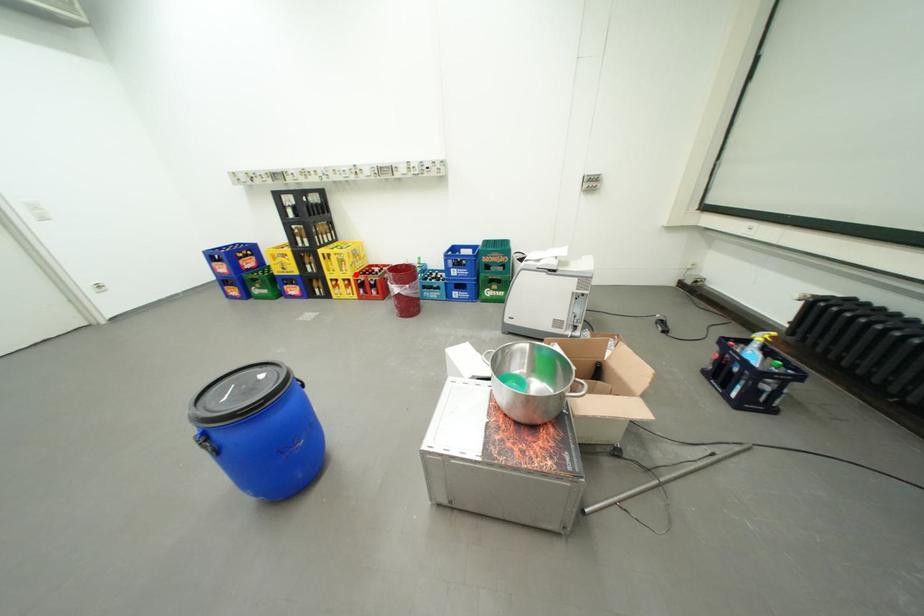
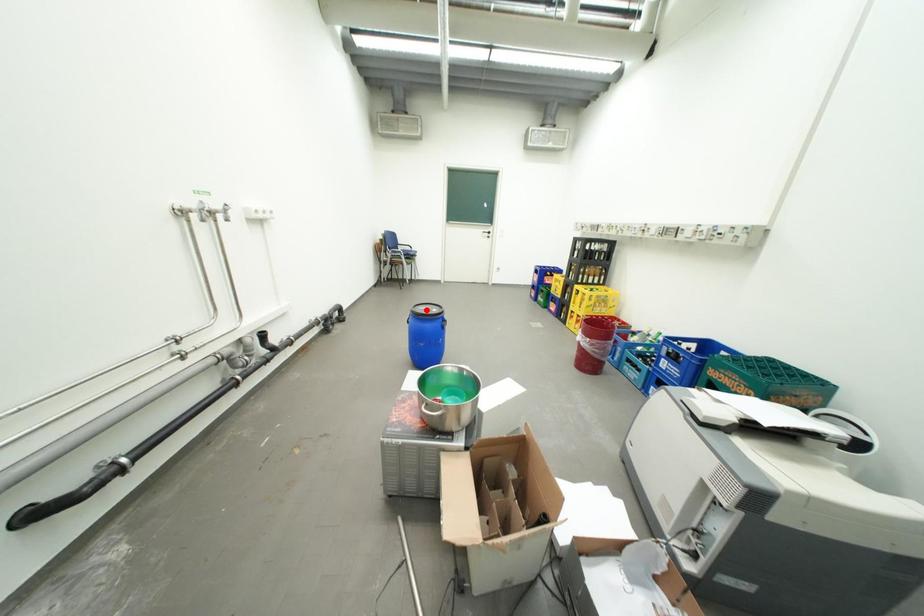
I am providing you with two images of the same scene from different viewpoints. A red point is marked on the first image and another point is marked on the second image. Is the red point in image1 aligned with the point shown in image2?

No